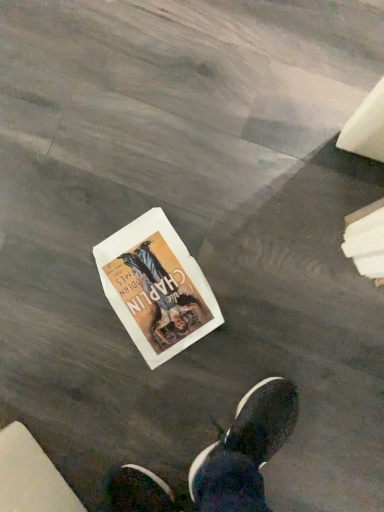
Find the location of a particular element. Image resolution: width=384 pixels, height=512 pixels. vacant area located to the right-hand side of white paper at center is located at coordinates (232, 223).